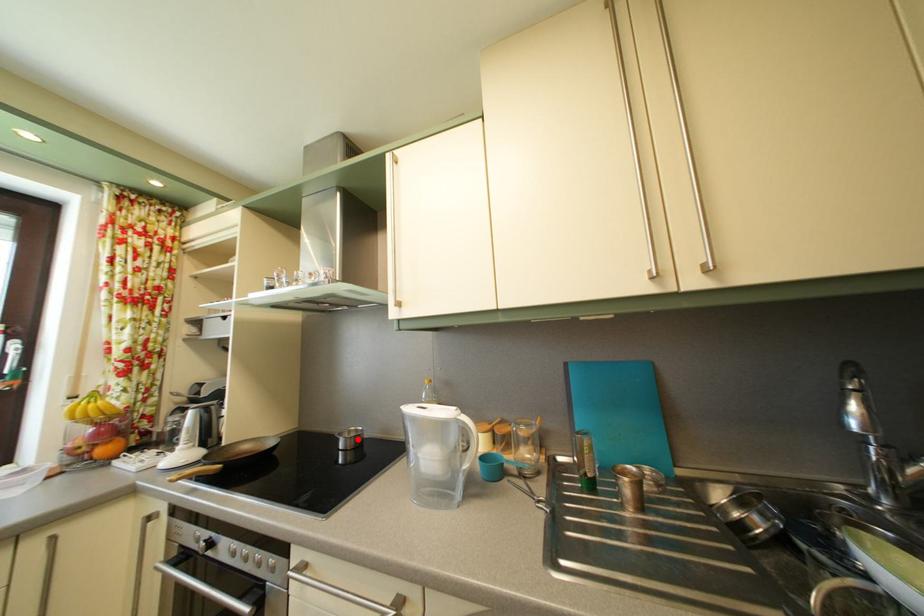
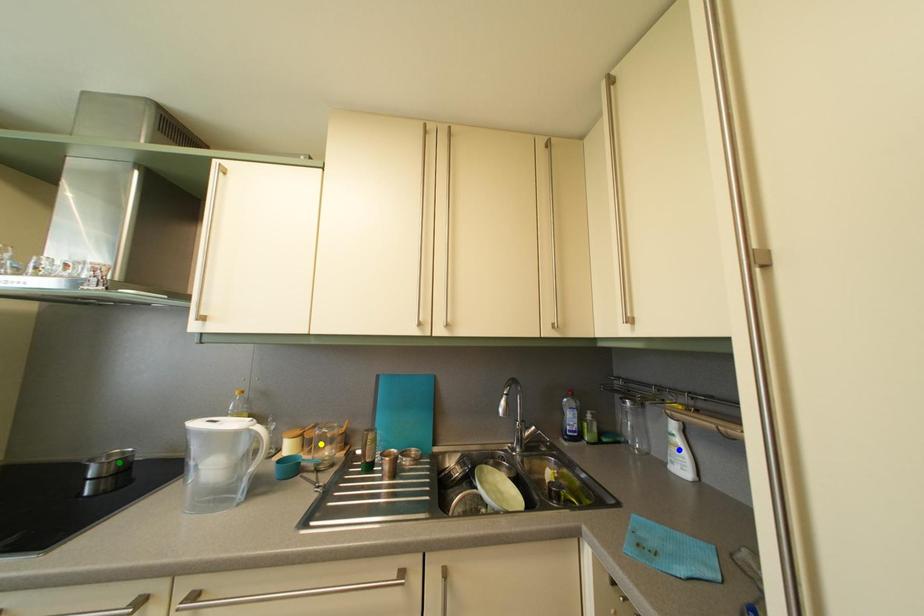
Question: I am providing you with two images of the same scene from different viewpoints. A red point is marked on the first image. You are given multiple points on the second image. Which point in image 2 is actually the same real-world point as the red point in image 1?

Choices:
 (A) green point
 (B) blue point
 (C) yellow point

Answer: (A)